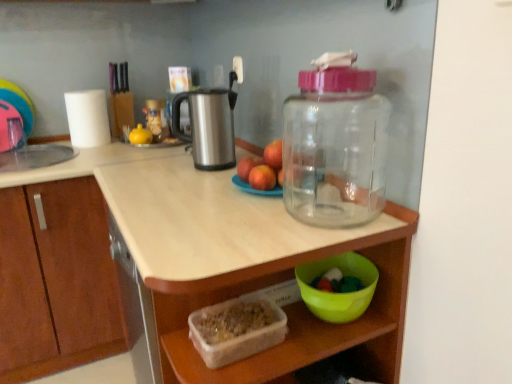
The image size is (512, 384). In order to click on empty space that is ontop of translucent plastic container at lower center in this screenshot , I will do `click(275, 228)`.